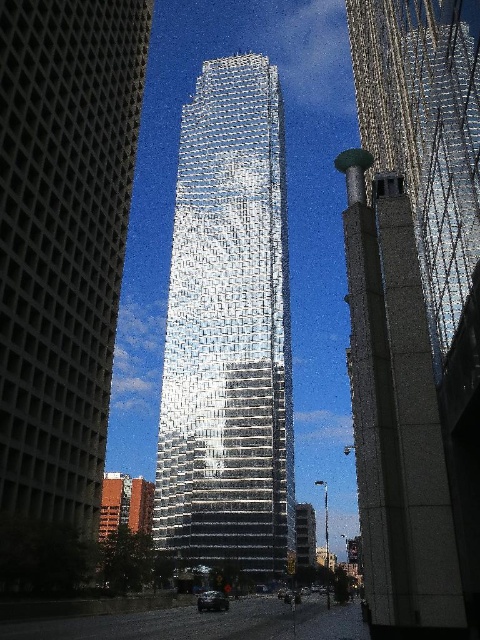
Which is behind, point (85, 115) or point (254, 454)?

The point (254, 454) is behind.

Does silver reflective glass tower at center lie behind reflective glass tower at center?

No, silver reflective glass tower at center is closer to the viewer.

You are a GUI agent. You are given a task and a screenshot of the screen. Output one action in this format:
    pyautogui.click(x=<x>, y=<y>)
    Task: Click on the silver reflective glass tower at center
    
    Given the screenshot: What is the action you would take?
    pyautogui.click(x=60, y=266)

Does gray concrete tower at center have a greater height compared to reflective glass skyscraper at right?

Incorrect, gray concrete tower at center's height is not larger of reflective glass skyscraper at right's.

Is gray concrete tower at center positioned in front of reflective glass skyscraper at right?

No.

Which is in front, point (392, 346) or point (469, 161)?

Positioned in front is point (469, 161).

Identify the location of gray concrete tower at center. The image size is (480, 640). (396, 419).

Between reflective glass tower at center and gray concrete tower at center, which one is positioned higher?

reflective glass tower at center is above.

Find the location of a particular element. reflective glass tower at center is located at coordinates (x=228, y=330).